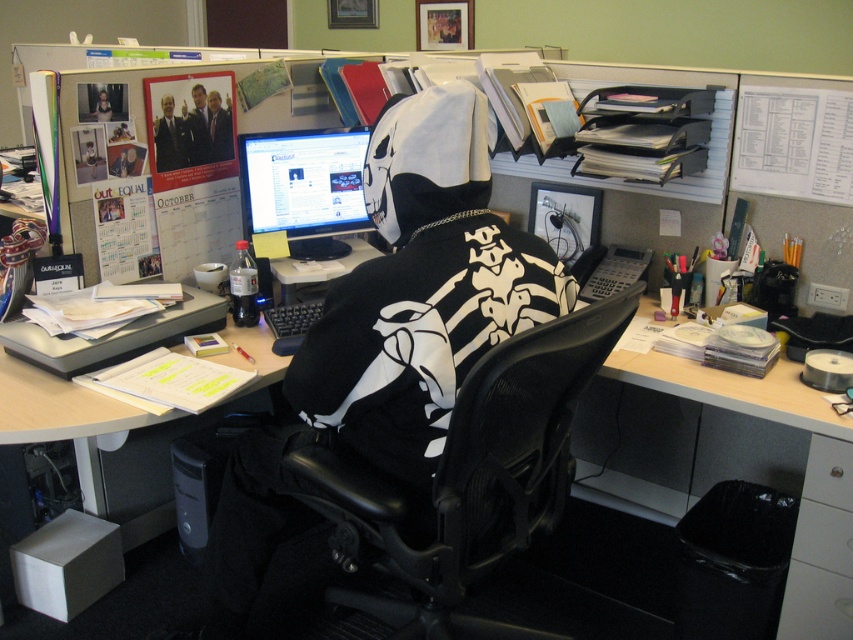
Image resolution: width=853 pixels, height=640 pixels. I want to click on matte black monitor at center, so click(x=305, y=188).

Between point (332, 244) and point (848, 547), which one is positioned in front?

Positioned in front is point (848, 547).

Is point (318, 221) positioned behind point (816, 538)?

Yes, point (318, 221) is behind point (816, 538).

Locate an element on the screen. The image size is (853, 640). matte black monitor at center is located at coordinates (305, 188).

Measure the distance from black mesh swivel chair at center to matte black monitor at center.

They are 31.84 inches apart.

Can you confirm if black mesh swivel chair at center is positioned below matte black monitor at center?

Yes.

Does point (332, 419) come in front of point (357, 168)?

Yes, it is.

Where is `black mesh swivel chair at center`? black mesh swivel chair at center is located at coordinates (386, 344).

Is black mesh office chair at center closer to the viewer compared to metallic silver drawer at lower right?

Yes.

Does black mesh office chair at center have a smaller size compared to metallic silver drawer at lower right?

No, black mesh office chair at center is not smaller than metallic silver drawer at lower right.

Which is behind, point (351, 564) or point (838, 483)?

Point (838, 483)

Locate an element on the screen. black mesh office chair at center is located at coordinates (469, 477).